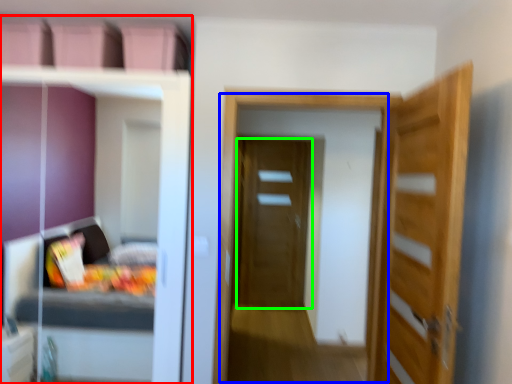
Question: Considering the real-world distances, which object is closest to dresser (highlighted by a red box)? screen door (highlighted by a blue box) or door (highlighted by a green box).

Choices:
 (A) screen door
 (B) door

Answer: (A)